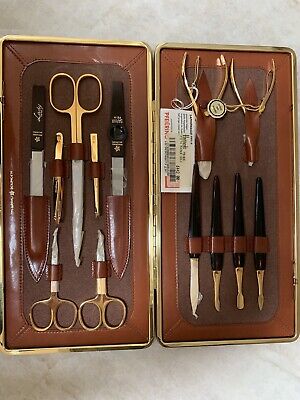
This screenshot has width=300, height=400. Find the location of `black handle`. black handle is located at coordinates (196, 216), (221, 220), (246, 224), (265, 221), (118, 137), (36, 133).